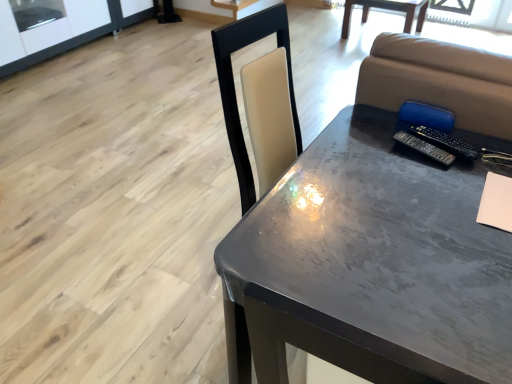
Question: From the image's perspective, is black plastic remote at right, the 2th remote viewed from the right, located above or below metallic gray table at center, positioned as the 2th table in front-to-back order?

Choices:
 (A) below
 (B) above

Answer: (A)

Question: From their relative heights in the image, would you say black plastic remote at right, which appears as the first remote when viewed from the left, is taller or shorter than metallic gray table at center, positioned as the 2th table in front-to-back order?

Choices:
 (A) tall
 (B) short

Answer: (B)

Question: Based on their relative distances, which object is nearer to the black plastic remote at right, the 2th remote viewed from the right?

Choices:
 (A) beige matte notebook at lower right
 (B) transparent glass window screen at upper left
 (C) metallic gray table at center, positioned as the 1th table in front-to-back order
 (D) blue fabric armchair at upper right
 (E) metallic gray table at center, the second table from the left

Answer: (D)

Question: Estimate the real-world distances between objects in this image. Which object is closer to the metallic gray table at center, which is counted as the first table, starting from the back?

Choices:
 (A) metallic gray table at center, positioned as the 1th table in front-to-back order
 (B) transparent glass window screen at upper left
 (C) black plastic remote at right, which appears as the first remote when viewed from the left
 (D) black plastic remote at upper right, which ranks as the second remote in left-to-right order
 (E) beige matte notebook at lower right

Answer: (B)